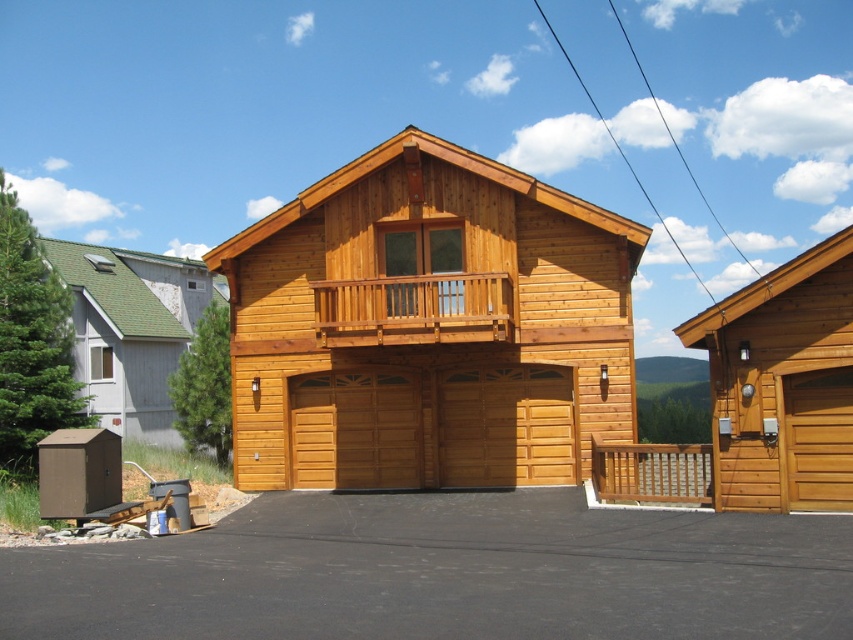
You are standing in front of the house and want to walk from the wooden cabin at right to the natural wood railing at center. Which direction should you move?

You should move to the left because the wooden cabin at right is to the right of the natural wood railing at center, so moving left will take you towards the railing.

You are a delivery person trying to determine which cabin is shorter. You see the wooden cabin at right and the white wood cabin at left. Which one should you choose if you need to deliver a package that requires a shorter height clearance?

The wooden cabin at right is not as tall as the white wood cabin at left, so you should choose the wooden cabin at right for the delivery requiring a shorter height clearance.

You are planning to park your car in front of the wooden cabin at right and the white wood cabin at left. Which cabin is closer to the driveway on the right side?

The wooden cabin at right is positioned on the right side of white wood cabin at left, so the wooden cabin at right is closer to the driveway on the right side.